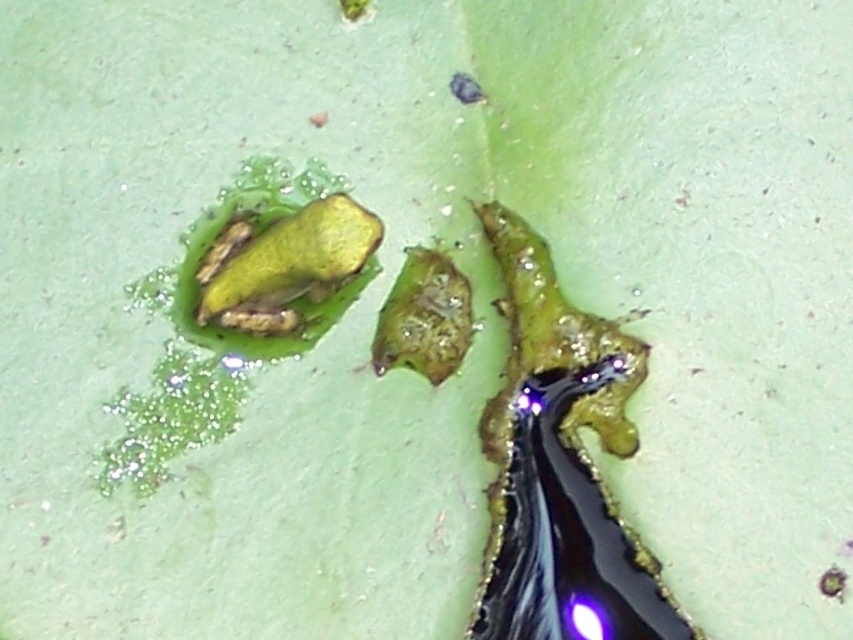
Question: In this image, where is glossy green frog at center located relative to green matte frog at center?

Choices:
 (A) right
 (B) left

Answer: (A)

Question: Which point is closer to the camera?

Choices:
 (A) green matte frog at center
 (B) glossy green frog at center

Answer: (B)

Question: From the image, what is the correct spatial relationship of glossy green frog at center in relation to green matte frog at center?

Choices:
 (A) right
 (B) left

Answer: (A)

Question: From the image, what is the correct spatial relationship of glossy green frog at center in relation to green matte frog at center?

Choices:
 (A) right
 (B) left

Answer: (A)